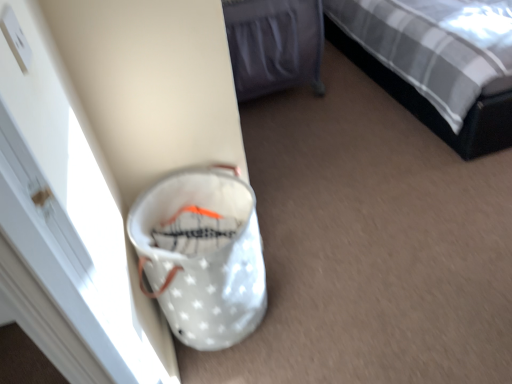
The height and width of the screenshot is (384, 512). I want to click on plaid fabric bed at upper right, so click(x=436, y=62).

Describe the element at coordinates (436, 62) in the screenshot. I see `plaid fabric bed at upper right` at that location.

The image size is (512, 384). What are the coordinates of `plaid fabric bed at upper right` in the screenshot? It's located at (436, 62).